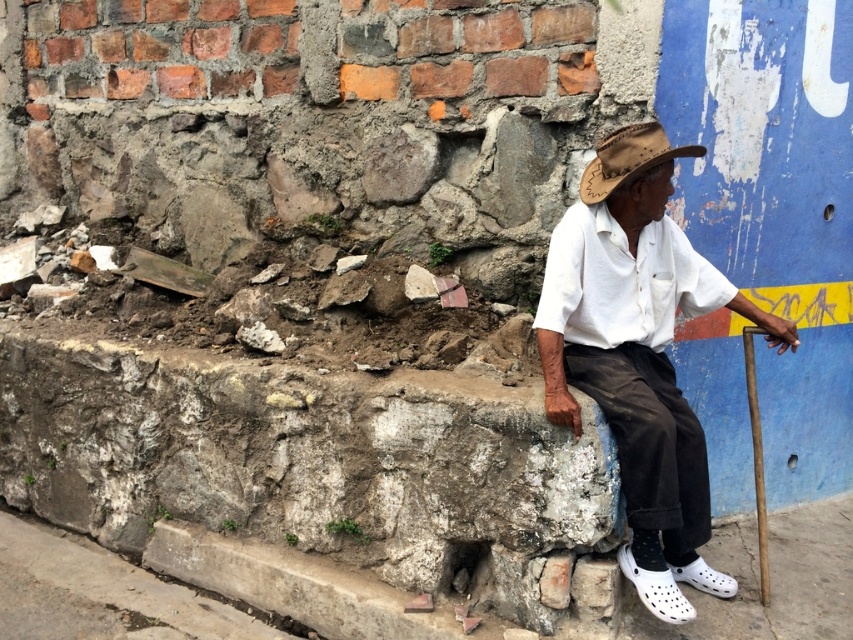
You are a photographer standing in front of the elderly man in the scene. You want to take a closeup shot of his white cotton shirt at center without moving the camera. Is the shirt within the camera focus range of 2 meters?

The white cotton shirt at center is 2.27 meters away from the camera, which is beyond the 2 meters focus range. Therefore, the shirt is out of focus range unless adjusted.

You are standing at the point marked as point (648, 164) and want to walk towards the point marked as point (654, 614). Which direction should you face to move directly towards your destination?

You should face towards the direction of point (654, 614) because it is behind point (648, 164) according to their coordinates.